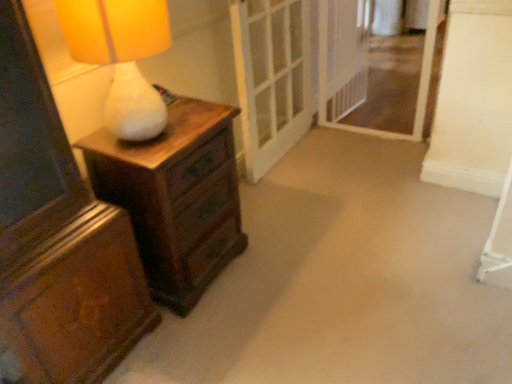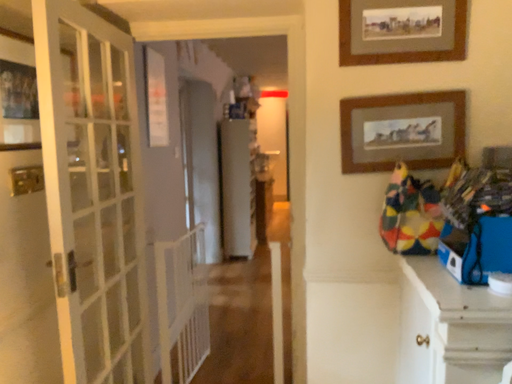
Question: Which way did the camera rotate in the video?

Choices:
 (A) rotated upward
 (B) rotated downward

Answer: (A)